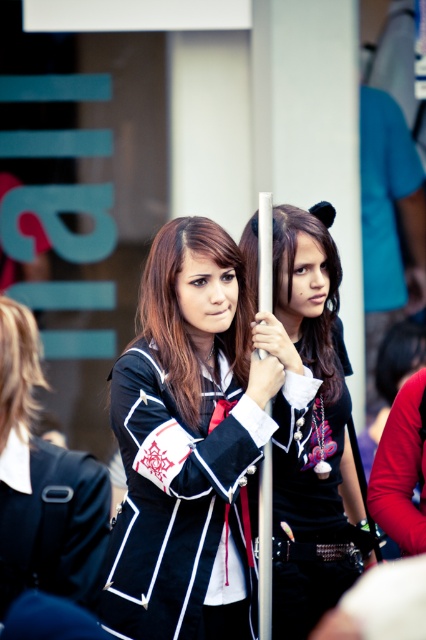
Where is `satin black uniform at center`? This screenshot has width=426, height=640. satin black uniform at center is located at coordinates (184, 314).

Locate an element on the screen. This screenshot has width=426, height=640. satin black uniform at center is located at coordinates (184, 314).

Between point (37, 440) and point (245, 316), which one is positioned behind?

The point (245, 316) is behind.

Between black satin school uniform at center and satin black uniform at center, which one has less height?

satin black uniform at center

Does point (60, 500) come behind point (157, 316)?

No, (60, 500) is closer to viewer.

This screenshot has width=426, height=640. Find the location of `black satin school uniform at center`. black satin school uniform at center is located at coordinates (43, 484).

Can you confirm if black matte jacket at center is positioned to the right of satin black uniform at center?

Indeed, black matte jacket at center is positioned on the right side of satin black uniform at center.

The width and height of the screenshot is (426, 640). Identify the location of black matte jacket at center. (311, 428).

Is point (287, 269) positioned behind point (160, 243)?

Yes, point (287, 269) is farther from viewer.

Locate an element on the screen. Image resolution: width=426 pixels, height=640 pixels. black matte jacket at center is located at coordinates tap(311, 428).